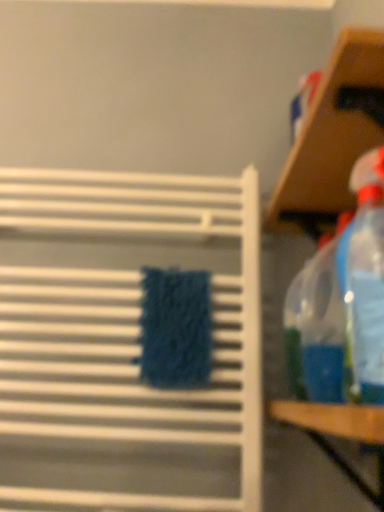
Question: From the image's perspective, does transparent plastic shelf at upper right, marked as the 2th shelf in a left-to-right arrangement, appear lower than wooden table at right?

Choices:
 (A) yes
 (B) no

Answer: (B)

Question: Is transparent plastic shelf at upper right, which is the first shelf in right-to-left order, outside wooden table at right?

Choices:
 (A) yes
 (B) no

Answer: (A)

Question: Considering the relative sizes of transparent plastic shelf at upper right, marked as the 2th shelf in a left-to-right arrangement, and wooden table at right in the image provided, is transparent plastic shelf at upper right, marked as the 2th shelf in a left-to-right arrangement, smaller than wooden table at right?

Choices:
 (A) no
 (B) yes

Answer: (A)

Question: Can you confirm if transparent plastic shelf at upper right, which is the first shelf in right-to-left order, is wider than wooden table at right?

Choices:
 (A) no
 (B) yes

Answer: (A)

Question: Can you confirm if transparent plastic shelf at upper right, which is the first shelf in right-to-left order, is shorter than wooden table at right?

Choices:
 (A) no
 (B) yes

Answer: (A)

Question: Is transparent plastic shelf at upper right, marked as the 2th shelf in a left-to-right arrangement, to the right of wooden table at right from the viewer's perspective?

Choices:
 (A) yes
 (B) no

Answer: (A)

Question: Considering the relative positions of transparent plastic spray bottle at right and transparent plastic shelf at upper right, which is the first shelf in right-to-left order, in the image provided, is transparent plastic spray bottle at right to the left of transparent plastic shelf at upper right, which is the first shelf in right-to-left order, from the viewer's perspective?

Choices:
 (A) no
 (B) yes

Answer: (B)

Question: Is transparent plastic spray bottle at right facing towards transparent plastic shelf at upper right, which is the first shelf in right-to-left order?

Choices:
 (A) no
 (B) yes

Answer: (A)

Question: From the image's perspective, does transparent plastic spray bottle at right appear higher than transparent plastic shelf at upper right, which is the first shelf in right-to-left order?

Choices:
 (A) yes
 (B) no

Answer: (B)

Question: From the image's perspective, is transparent plastic spray bottle at right located beneath transparent plastic shelf at upper right, which is the first shelf in right-to-left order?

Choices:
 (A) no
 (B) yes

Answer: (B)

Question: Is transparent plastic shelf at upper right, marked as the 2th shelf in a left-to-right arrangement, at the back of transparent plastic spray bottle at right?

Choices:
 (A) yes
 (B) no

Answer: (B)

Question: Is transparent plastic spray bottle at right behind transparent plastic shelf at upper right, which is the first shelf in right-to-left order?

Choices:
 (A) yes
 (B) no

Answer: (A)

Question: Is transparent plastic shelf at upper right, which is the first shelf in right-to-left order, taller than white textured towel rack at center, the second shelf when ordered from right to left?

Choices:
 (A) no
 (B) yes

Answer: (A)